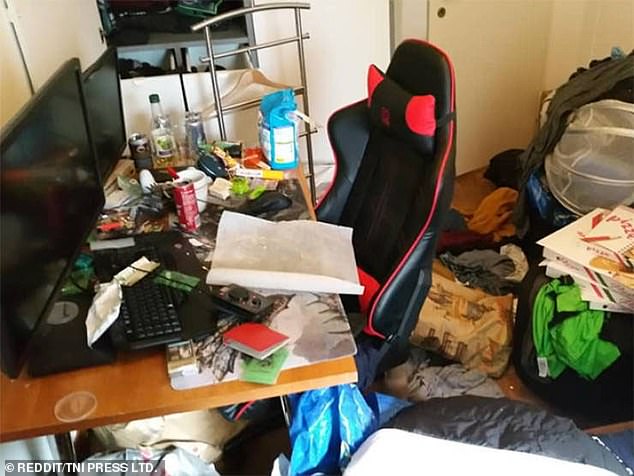
This screenshot has width=634, height=476. In order to click on hanger in this screenshot , I will do `click(249, 76)`.